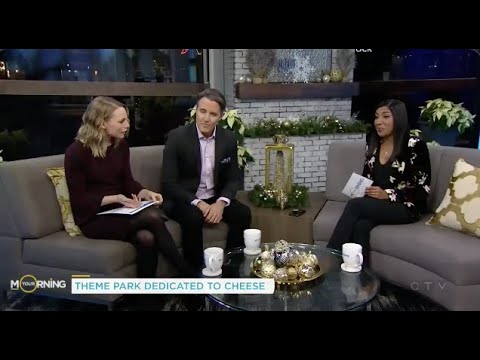
This screenshot has width=480, height=360. Find the location of `ornaments`. ornaments is located at coordinates (293, 259).